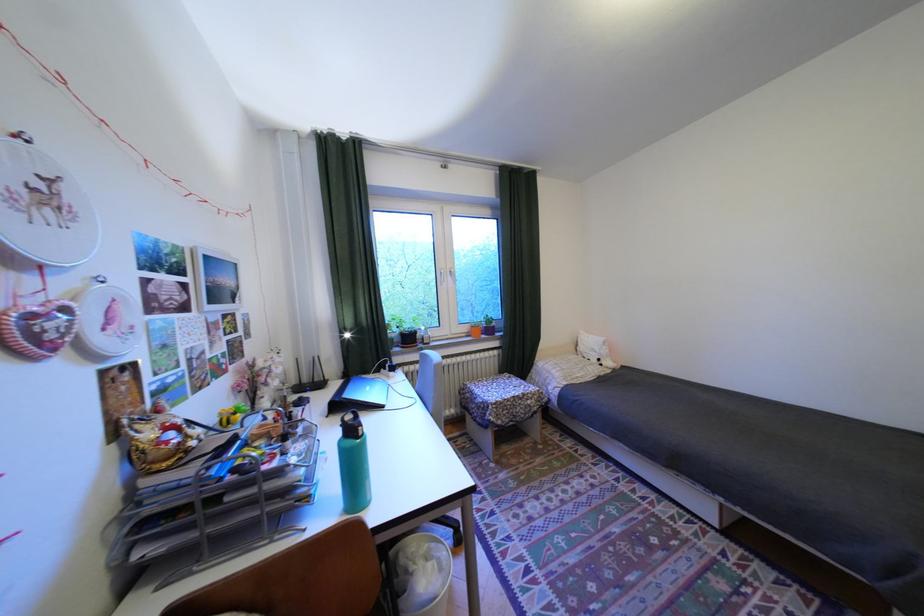
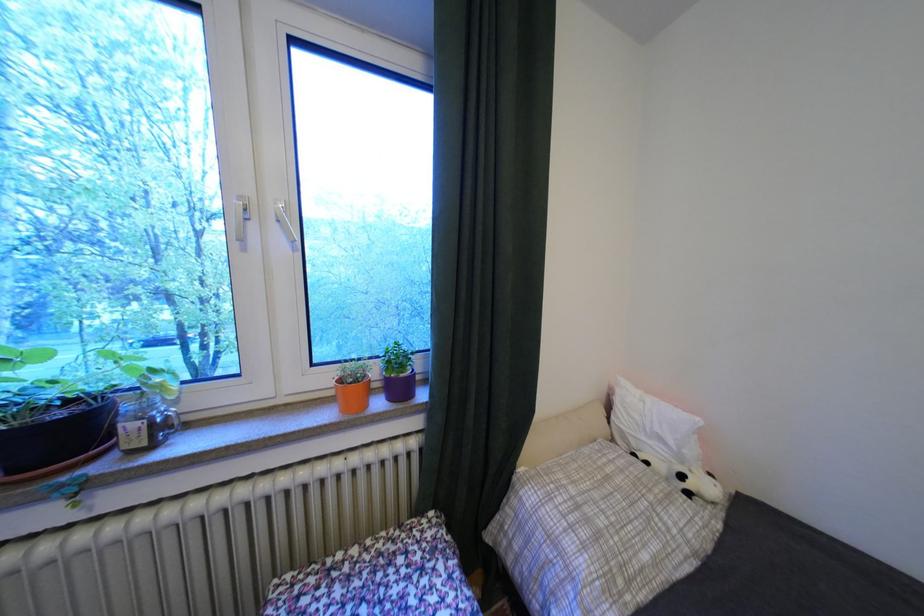
Locate, in the second image, the point that corresponds to point (593, 377) in the first image.

(667, 562)